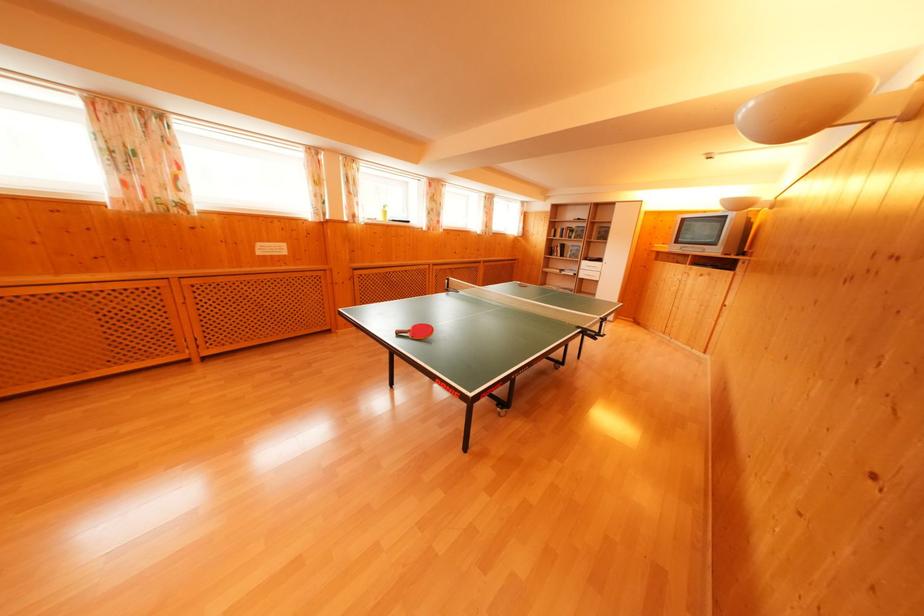
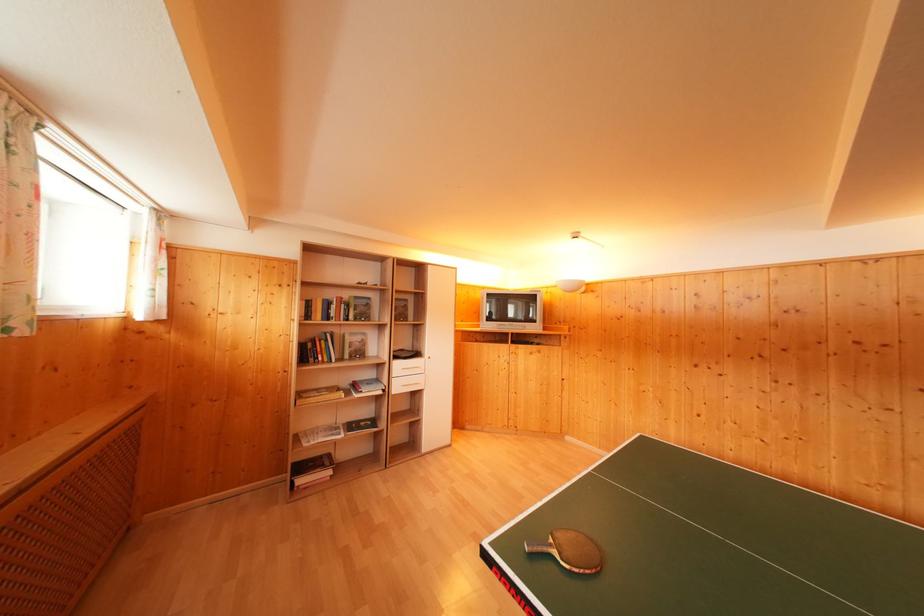
Locate, in the second image, the point that corresponds to pixel 587 273 in the first image.

(398, 379)